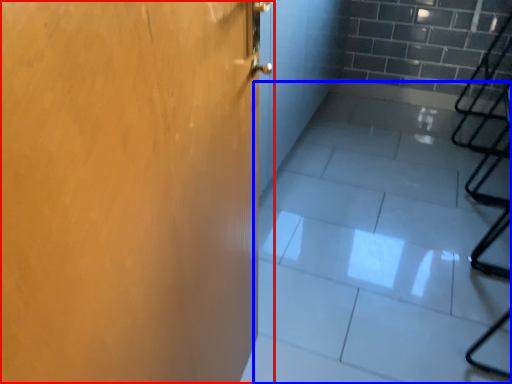
Question: Among these objects, which one is nearest to the camera, door (highlighted by a red box) or concrete (highlighted by a blue box)?

Choices:
 (A) door
 (B) concrete

Answer: (A)